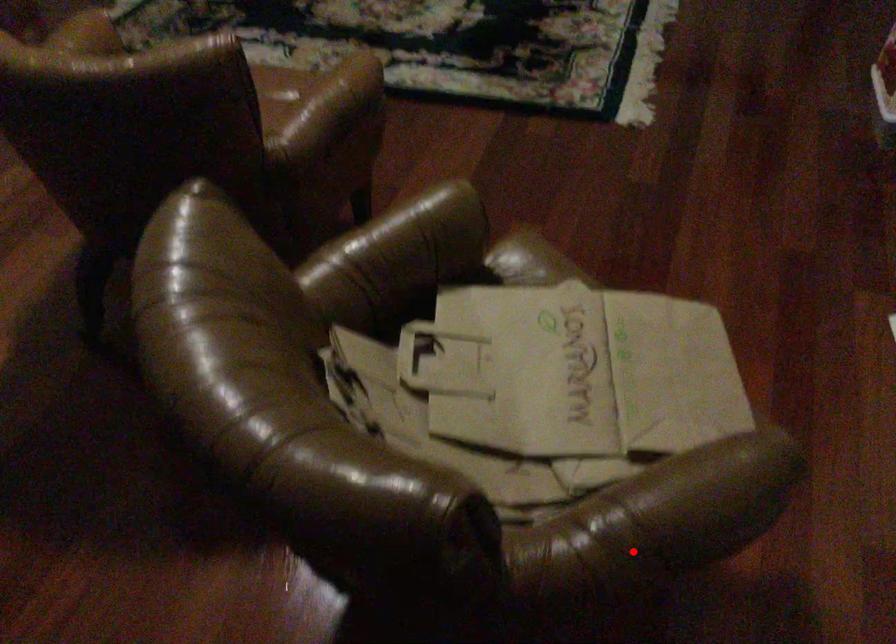
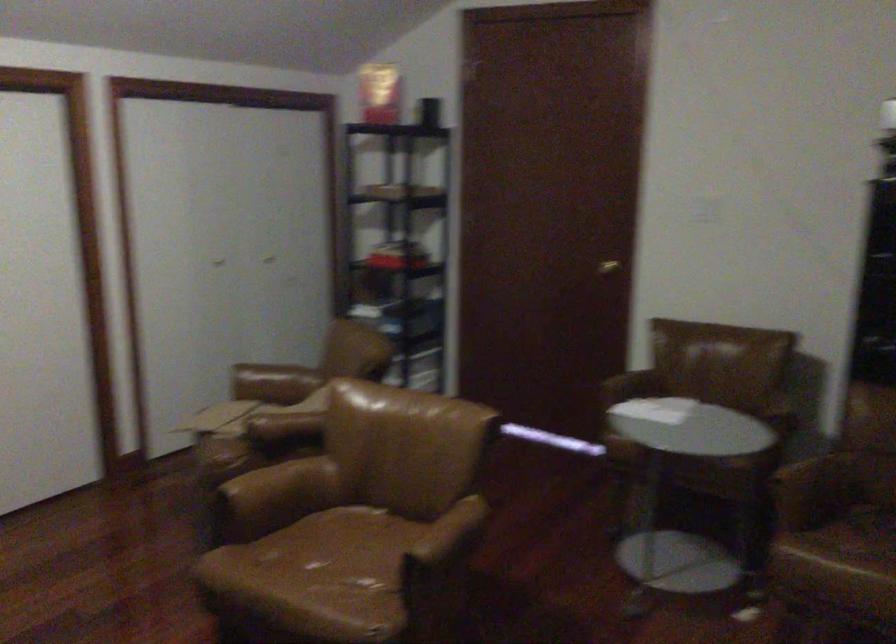
Where in the second image is the point corresponding to the highlighted location from the first image?

(273, 383)